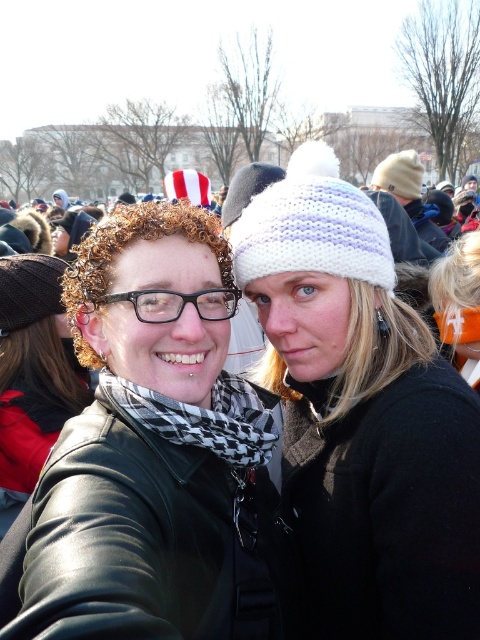
Question: Where is matte black jacket at center located in relation to black and white checkered scarf at center in the image?

Choices:
 (A) above
 (B) below

Answer: (B)

Question: Among these points, which one is nearest to the camera?

Choices:
 (A) (415, 179)
 (B) (223, 292)

Answer: (B)

Question: Which is farther from the blonde hair at center?

Choices:
 (A) white knitted hat at upper center
 (B) black plastic glasses at center
 (C) black and white checkered scarf at center

Answer: (A)

Question: Based on their relative distances, which object is nearer to the white knitted hat at upper center?

Choices:
 (A) matte black jacket at center
 (B) black and white checkered scarf at center
 (C) blonde hair at center
 (D) black plastic glasses at center

Answer: (C)

Question: Can you confirm if blonde hair at center is positioned below black plastic glasses at center?

Choices:
 (A) yes
 (B) no

Answer: (B)

Question: Does matte black jacket at center have a greater width compared to black and white checkered scarf at center?

Choices:
 (A) yes
 (B) no

Answer: (B)